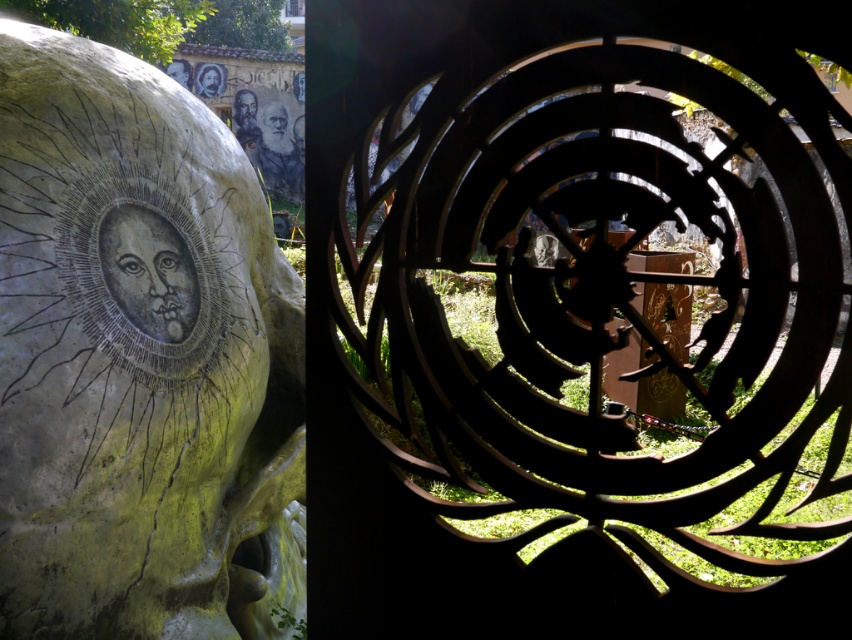
Consider the image. You are an art curator examining the left side of the image. You notice the matte stone face at center and the matte black face at upper center. Which one is positioned higher up in the image?

The matte black face at upper center is positioned higher up in the image than the matte stone face at center.

From the picture: You are an art curator examining two faces in the image. The first is the matte stone face at center, and the second is the matte black face at upper center. Which of these two faces is shorter in height?

The matte stone face at center has a lesser height compared to the matte black face at upper center, so the matte stone face at center is shorter in height.